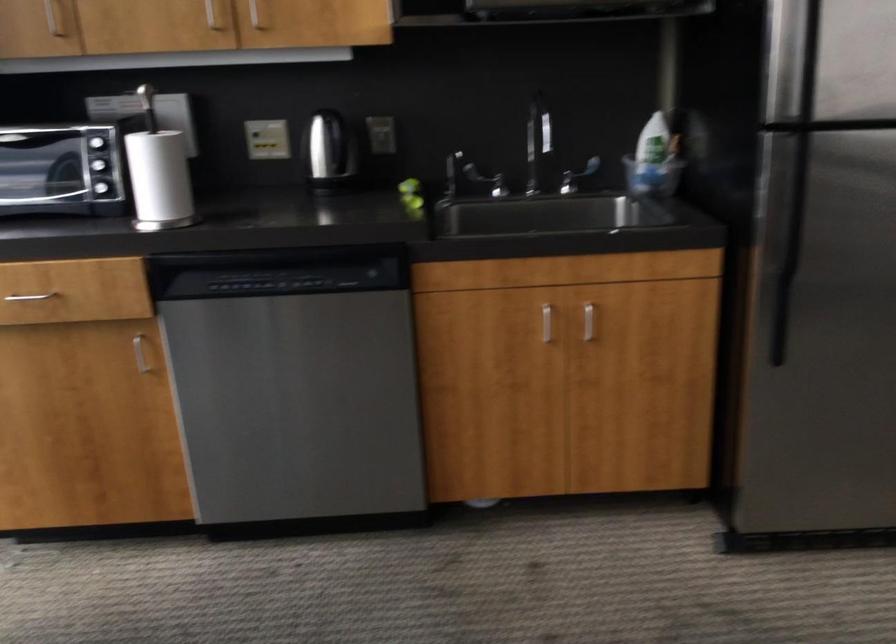
You are a GUI agent. You are given a task and a screenshot of the screen. Output one action in this format:
    pyautogui.click(x=<x>, y=<y>)
    Task: Click on the dish soap bottle
    Image resolution: width=896 pixels, height=644 pixels.
    Given the screenshot: What is the action you would take?
    pyautogui.click(x=650, y=155)